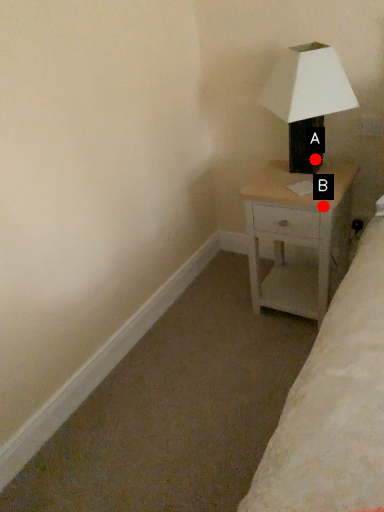
Question: Two points are circled on the image, labeled by A and B beside each circle. Which point is closer to the camera?

Choices:
 (A) A is closer
 (B) B is closer

Answer: (B)